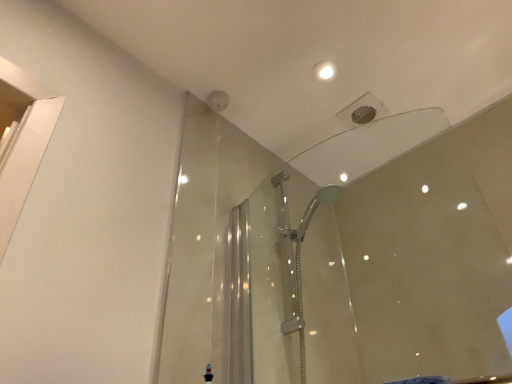
This screenshot has width=512, height=384. What do you see at coordinates (370, 263) in the screenshot? I see `transparent glass mirror at upper center` at bounding box center [370, 263].

Find the location of `transparent glass mirror at upper center`. transparent glass mirror at upper center is located at coordinates (370, 263).

Where is `transparent glass mirror at upper center`? Image resolution: width=512 pixels, height=384 pixels. transparent glass mirror at upper center is located at coordinates (370, 263).